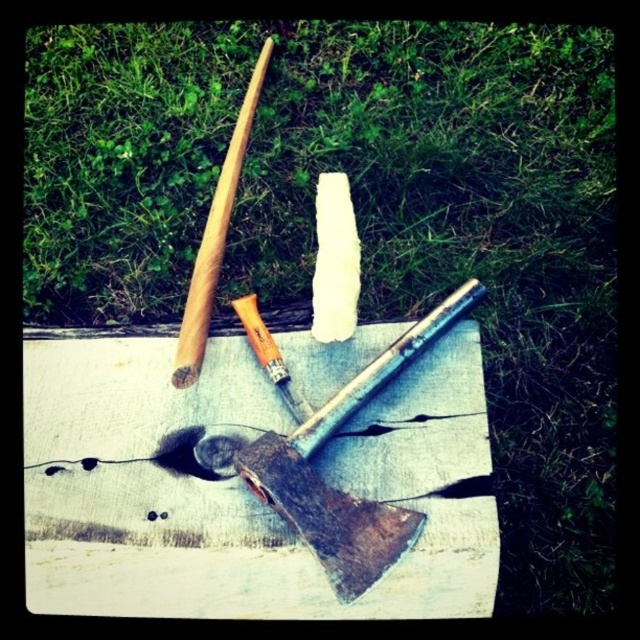
You are organizing tools on a wooden surface and need to stack the smooth wooden board at center and the wooden baseball bat at upper left vertically. Which one should you place at the bottom to ensure stability?

The smooth wooden board at center has a lesser height compared to the wooden baseball bat at upper left, so placing the shorter smooth wooden board at center at the bottom would provide a stable base.

You are organizing tools on a wooden surface and notice the smooth wooden board at center and the white plastic blade at center. Which object is closer to you when standing in front of the surface?

The smooth wooden board at center is closer to you because it is in front of the white plastic blade at center.

What is located at the point with coordinates (240, 486)?

The point at (240, 486) is where the smooth wooden board at center is located.